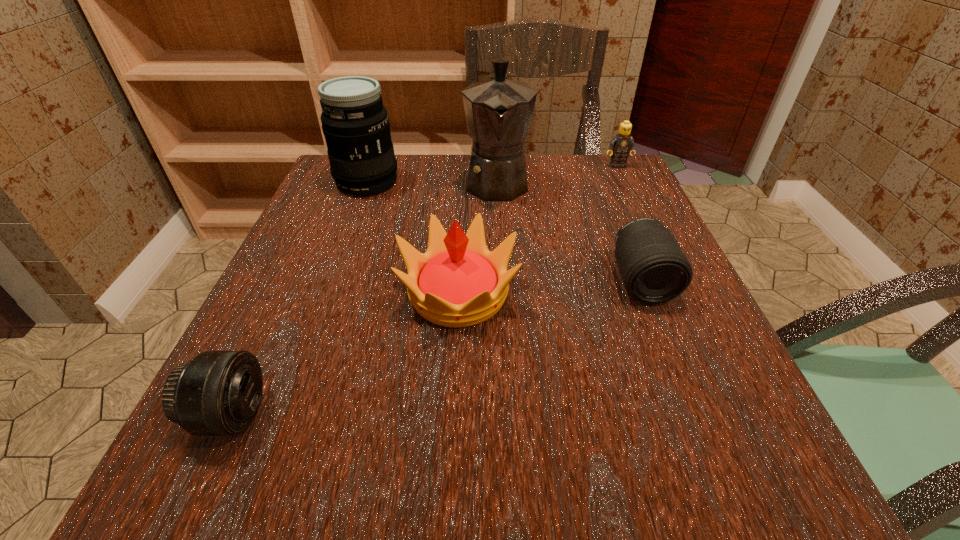
Locate an element on the screen. object at the near left corner is located at coordinates (216, 393).

Identify the location of object at the far right corner. This screenshot has height=540, width=960. (620, 145).

At what (x,y) coordinates should I click in order to perform the action: click on free space at the far edge of the desktop. Please return your answer as a coordinate pair (x, y). Looking at the image, I should click on (570, 195).

This screenshot has width=960, height=540. In the image, there is a desktop. Identify the location of vacant space at the near edge. (x=492, y=456).

I want to click on vacant space at the left edge of the desktop, so click(281, 263).

Locate an element on the screen. The image size is (960, 540). vacant space at the right edge is located at coordinates (702, 375).

This screenshot has width=960, height=540. In the image, there is a desktop. Identify the location of vacant space at the far right corner. (583, 165).

In the image, there is a desktop. Where is `vacant space at the near right corner`? vacant space at the near right corner is located at coordinates (722, 496).

Identify the location of free space between the nearest object and the third tallest object. The height and width of the screenshot is (540, 960). (345, 354).

This screenshot has width=960, height=540. I want to click on free area in between the fourth shortest object and the tallest telephoto lens, so click(413, 237).